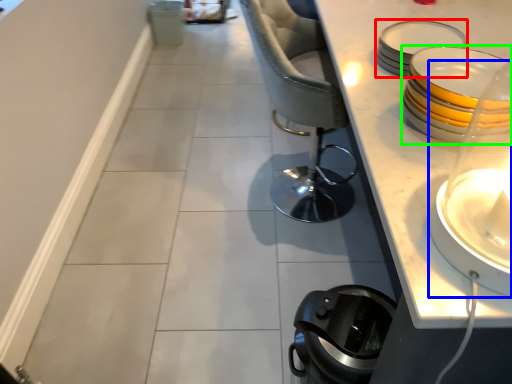
Question: Based on their relative distances, which object is farther from tableware (highlighted by a red box)? Choose from candle holder (highlighted by a blue box) and tableware (highlighted by a green box).

Choices:
 (A) candle holder
 (B) tableware

Answer: (A)